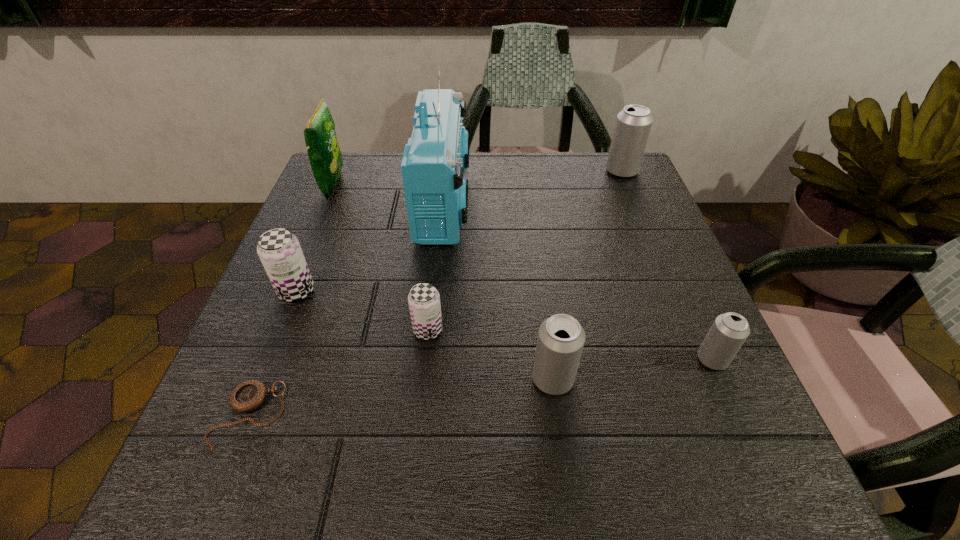
The width and height of the screenshot is (960, 540). What are the coordinates of `the nearer purple beer can` in the screenshot? It's located at (424, 300).

You are a GUI agent. You are given a task and a screenshot of the screen. Output one action in this format:
    pyautogui.click(x=<x>, y=<y>)
    Task: Click on the smallest white beer can
    
    Given the screenshot: What is the action you would take?
    pyautogui.click(x=729, y=331)

This screenshot has height=540, width=960. I want to click on pocket watch, so click(x=249, y=395).

Find the location of a particular element. free space located 0.300m on the front-facing side of the radio receiver is located at coordinates (594, 201).

Identify the location of blank space located on the front-facing side of the crisp (potato chip). The image size is (960, 540). (480, 185).

You are a GUI agent. You are given a task and a screenshot of the screen. Output one action in this format:
    pyautogui.click(x=<x>, y=<y>)
    Task: Click on the vacant position located on the left of the tallest beer can
    This screenshot has height=540, width=960.
    Given the screenshot: What is the action you would take?
    pyautogui.click(x=564, y=171)

You are a GUI agent. You are given a task and a screenshot of the screen. Output one action in this format:
    pyautogui.click(x=<x>, y=<y>)
    Task: Click on the free spot located on the back of the second farthest beer can
    
    Given the screenshot: What is the action you would take?
    pyautogui.click(x=330, y=206)

At what (x,y) coordinates should I click in order to perform the action: click on vacant region located 0.290m on the left of the leftmost white beer can. Please return your answer as a coordinate pair (x, y). Looking at the image, I should click on (352, 379).

This screenshot has width=960, height=540. Identify the location of free region located on the right of the right purple beer can. (572, 330).

Locate an element on the screen. The image size is (960, 540). vacant region located 0.300m on the left of the smallest white beer can is located at coordinates (518, 359).